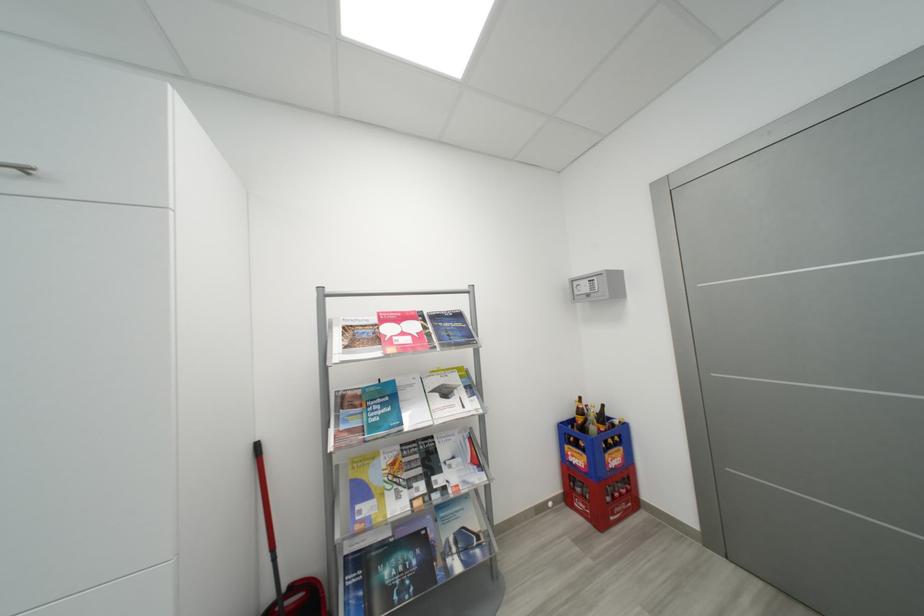
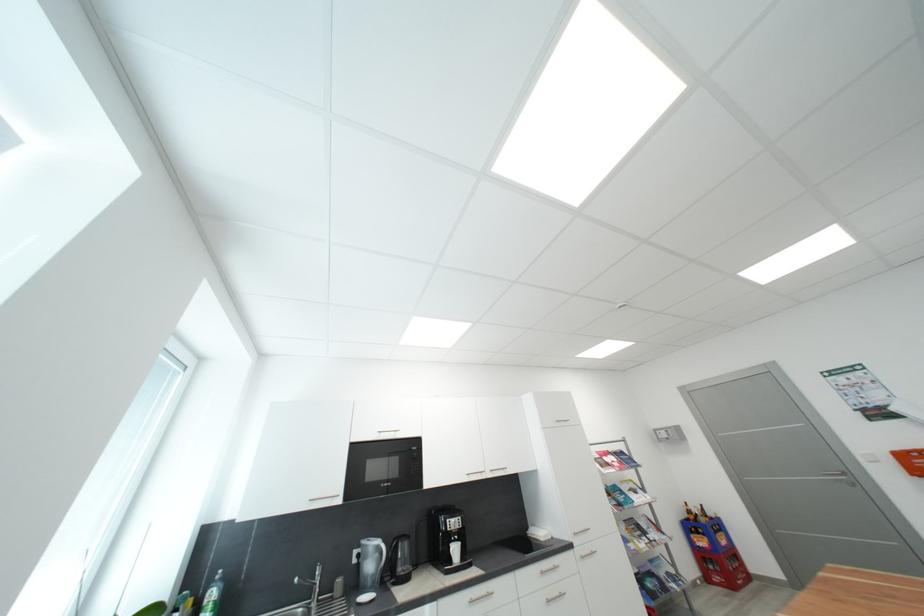
Where in the second image is the point corresponding to (x=600, y=430) from the first image?

(710, 522)